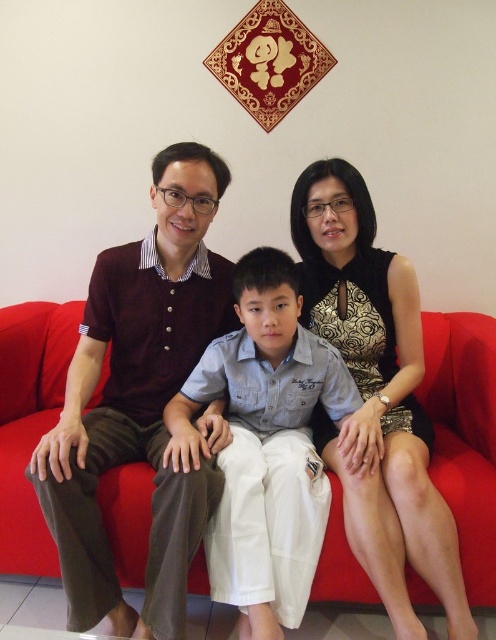
You are a home decorator planning to place a new decorative item on the sofa. The maroon knitwear at center and the red fabric couch at center are both visible from the front. Which object should you avoid placing the item on to ensure it is visible from the front?

You should avoid placing the item on the maroon knitwear at center because it is in front of the red fabric couch at center, so placing it on the couch might be obstructed by the knitwear.

You are standing in the living room and want to place a small plant pot on the floor directly in front of the black textured dress at center. According to the coordinates provided, where should you place the plant pot relative to the sofa?

The black textured dress at center is located at coordinates point (x=375, y=396). Therefore, you should place the plant pot directly in front of the sofa at that point.

You are a delivery person trying to place a small package on the couch between the red fabric couch at center and the light blue cotton shirt at center. Is there enough space for the package?

The distance between the red fabric couch at center and the light blue cotton shirt at center is 12.80 inches, so there is sufficient space to place the small package between them.